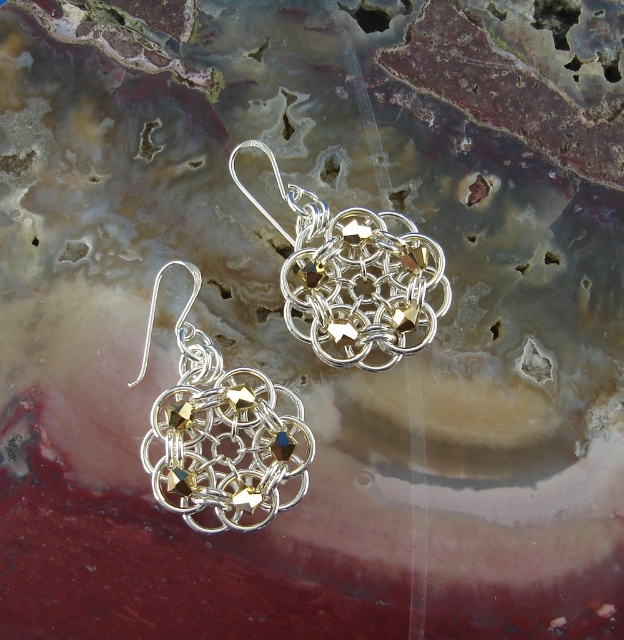
Question: Which point is farther to the camera?

Choices:
 (A) (182, 477)
 (B) (323, 355)

Answer: (B)

Question: Is silver/golden wire mesh earring at center closer to the viewer compared to silver/golden wirework earring at center?

Choices:
 (A) yes
 (B) no

Answer: (A)

Question: Among these objects, which one is nearest to the camera?

Choices:
 (A) silver/golden wire mesh earring at center
 (B) silver/golden wirework earring at center

Answer: (A)

Question: Does silver/golden wire mesh earring at center lie in front of silver/golden wirework earring at center?

Choices:
 (A) yes
 (B) no

Answer: (A)

Question: Is silver/golden wire mesh earring at center smaller than silver/golden wirework earring at center?

Choices:
 (A) yes
 (B) no

Answer: (B)

Question: Which object appears farthest from the camera in this image?

Choices:
 (A) silver/golden wirework earring at center
 (B) silver/golden wire mesh earring at center

Answer: (A)